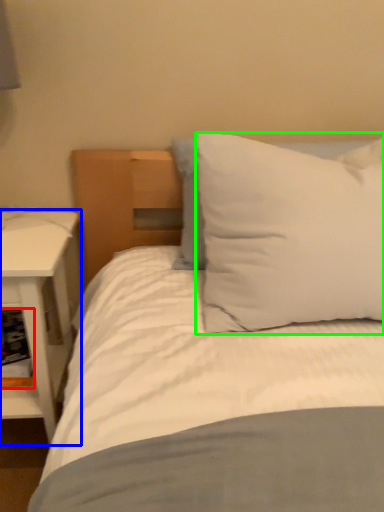
Question: Which is nearer to the shelf (highlighted by a red box)? nightstand (highlighted by a blue box) or pillow (highlighted by a green box).

Choices:
 (A) nightstand
 (B) pillow

Answer: (A)